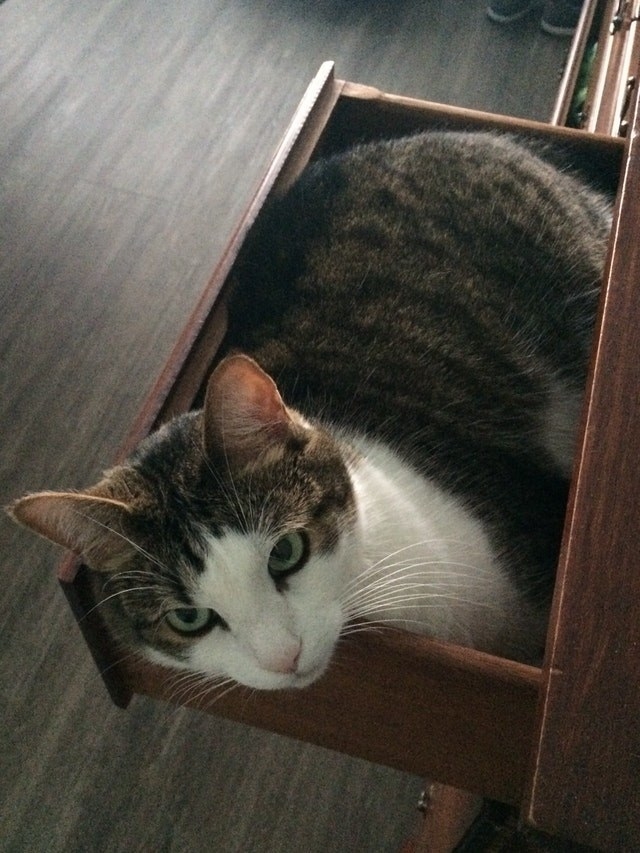
Locate an element on the screen. This screenshot has height=853, width=640. floor is located at coordinates (155, 755).